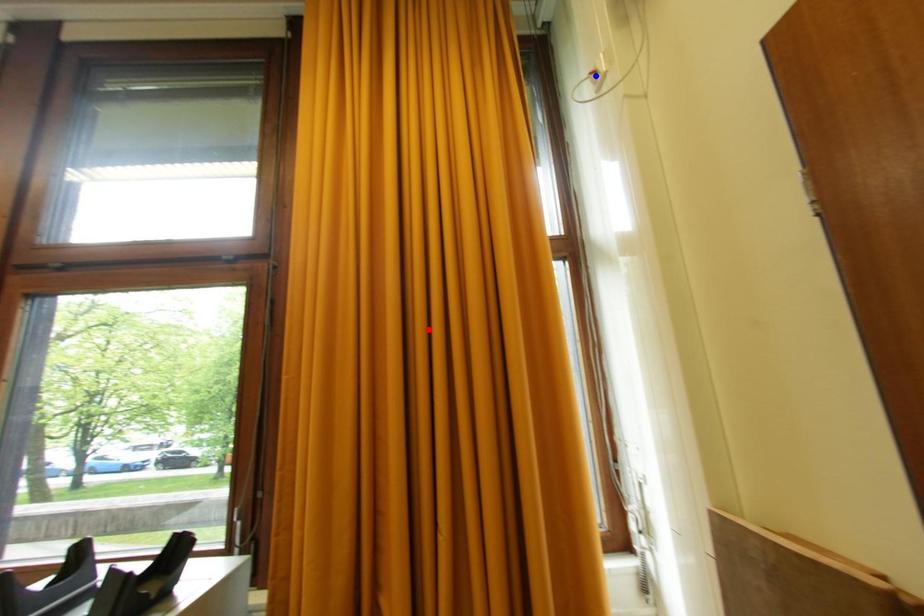
Question: Two points are marked on the image. Which point is closer to the camera?

Choices:
 (A) Blue point is closer.
 (B) Red point is closer.

Answer: (B)